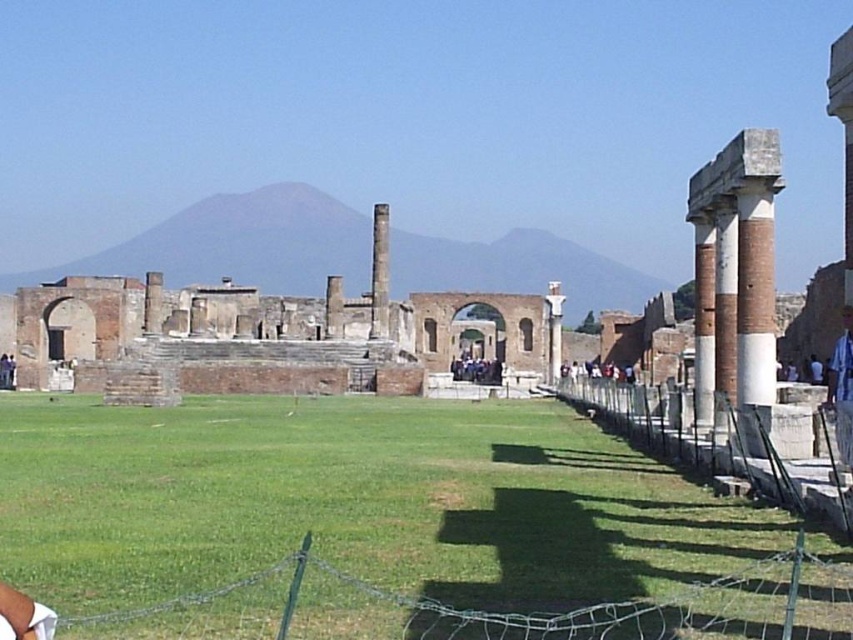
You are an archaeologist examining the ancient Roman ruins. You notice the red brick column at right and the smooth stone pillar at center. Which structure would cast a longer shadow given the current sunlight angle?

The red brick column at right is much taller than the smooth stone pillar at center, so it would cast a longer shadow.

You are an archaeologist examining the ancient Roman ruins. You notice the red brick column at right and the white stone fence at right. Which object is positioned higher in the scene?

The red brick column at right is located above the white stone fence at right, so it is positioned higher in the scene.

You are an archaeologist examining the ancient Roman site. You notice the green wire mesh at lower center and the dark gray stone people at center. Which object is positioned lower in the scene?

The green wire mesh at lower center is positioned below the dark gray stone people at center, so it is lower in the scene.